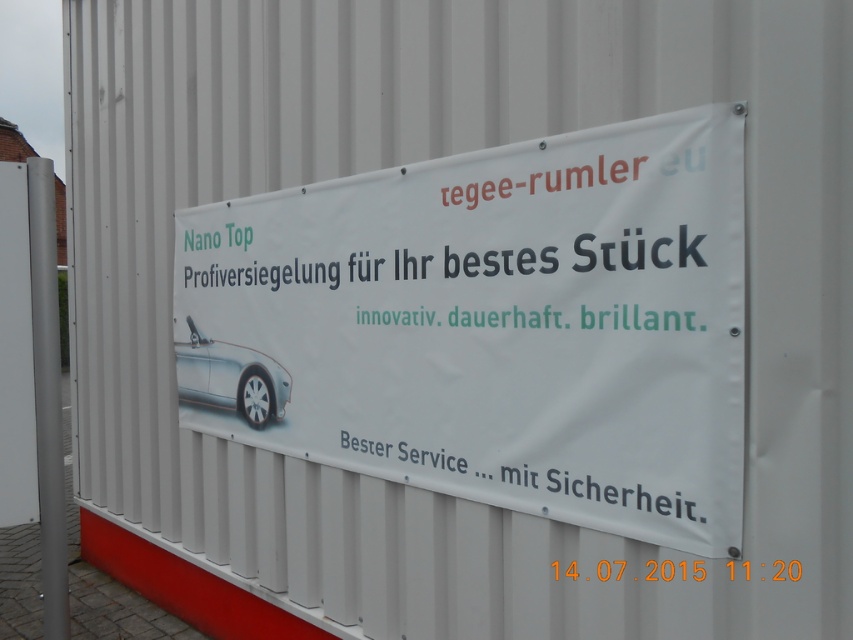
Question: In this image, where is white matte banner at center located relative to silver metallic car at center?

Choices:
 (A) right
 (B) left

Answer: (A)

Question: Which of the following is the closest to the observer?

Choices:
 (A) silver metallic car at center
 (B) white matte banner at center

Answer: (B)

Question: Among these objects, which one is farthest from the camera?

Choices:
 (A) silver metallic car at center
 (B) white matte banner at center

Answer: (A)

Question: Does white matte banner at center appear on the right side of silver metallic car at center?

Choices:
 (A) yes
 (B) no

Answer: (A)

Question: Which point is farther to the camera?

Choices:
 (A) white matte banner at center
 (B) silver metallic car at center

Answer: (B)

Question: Is white matte banner at center further to camera compared to silver metallic car at center?

Choices:
 (A) no
 (B) yes

Answer: (A)